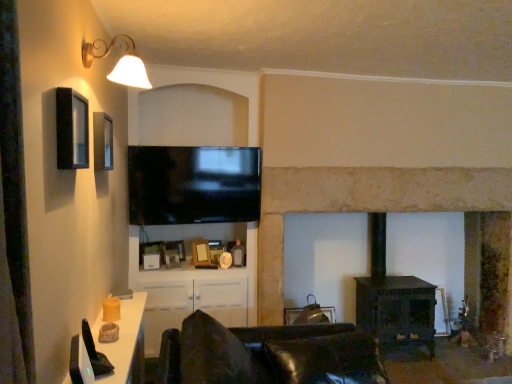
Question: Relative to leather couch at center, is matte glass window at upper left in front or behind?

Choices:
 (A) front
 (B) behind

Answer: (B)

Question: Would you say matte glass window at upper left is inside or outside leather couch at center?

Choices:
 (A) inside
 (B) outside

Answer: (B)

Question: Estimate the real-world distances between objects in this image. Which object is farther from the white glossy table at lower left?

Choices:
 (A) matte black picture frame at upper left, which is the 2th picture frame in back-to-front order
 (B) gold metallic wall sconce at upper left
 (C) wooden picture frame at center, the first picture frame positioned from the bottom
 (D) matte glass window at upper left
 (E) black glossy tv at center

Answer: (C)

Question: Which object is the farthest from the stone fireplace at center?

Choices:
 (A) gold metallic wall sconce at upper left
 (B) matte glass window at upper left
 (C) wooden picture frame at center, positioned as the second picture frame in front-to-back order
 (D) matte black picture frame at upper left, the second picture frame ordered from the bottom
 (E) white glossy table at lower left

Answer: (B)